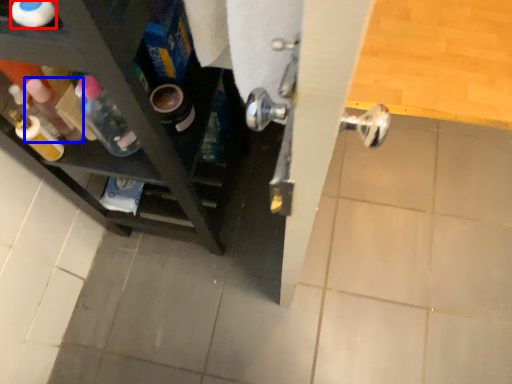
Question: Which of the following is the closest to the observer, bottle (highlighted by a red box) or bottle (highlighted by a blue box)?

Choices:
 (A) bottle
 (B) bottle

Answer: (A)